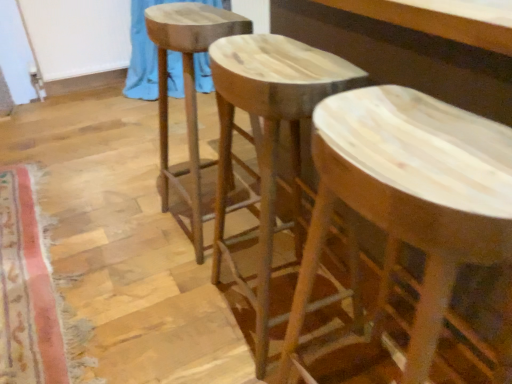
This screenshot has height=384, width=512. I want to click on blank space to the left of natural wood stool at center, the third stool positioned from the right, so click(x=130, y=226).